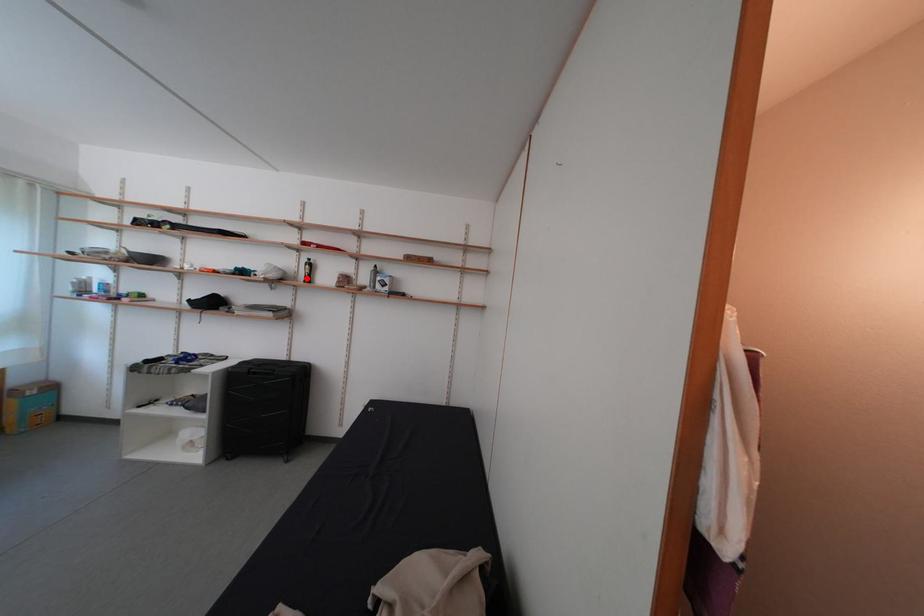
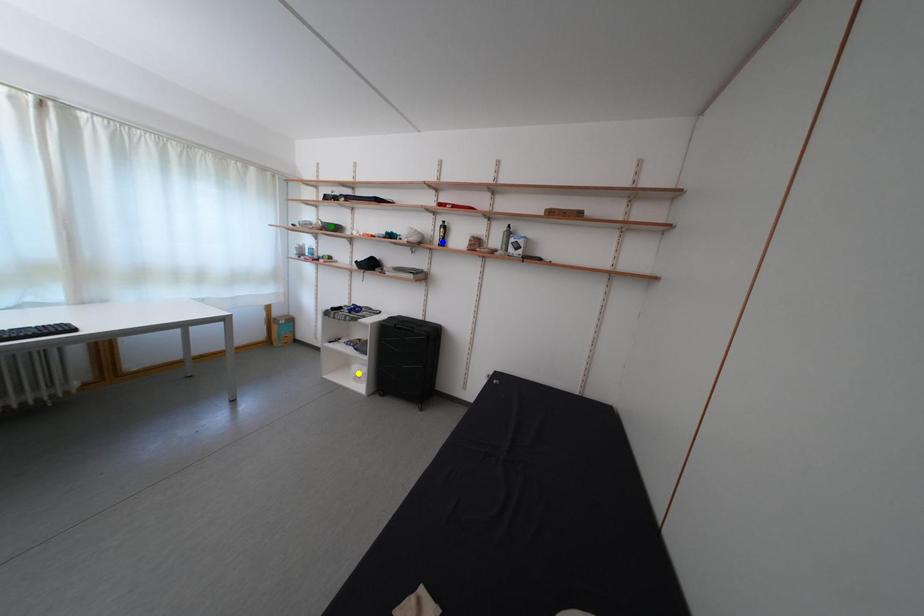
Question: I am providing you with two images of the same scene from different viewpoints. A red point is marked on the first image. You are given multiple points on the second image. Which point in image 2 represents the same 3d spot as the red point in image 1?

Choices:
 (A) green point
 (B) yellow point
 (C) blue point

Answer: (C)